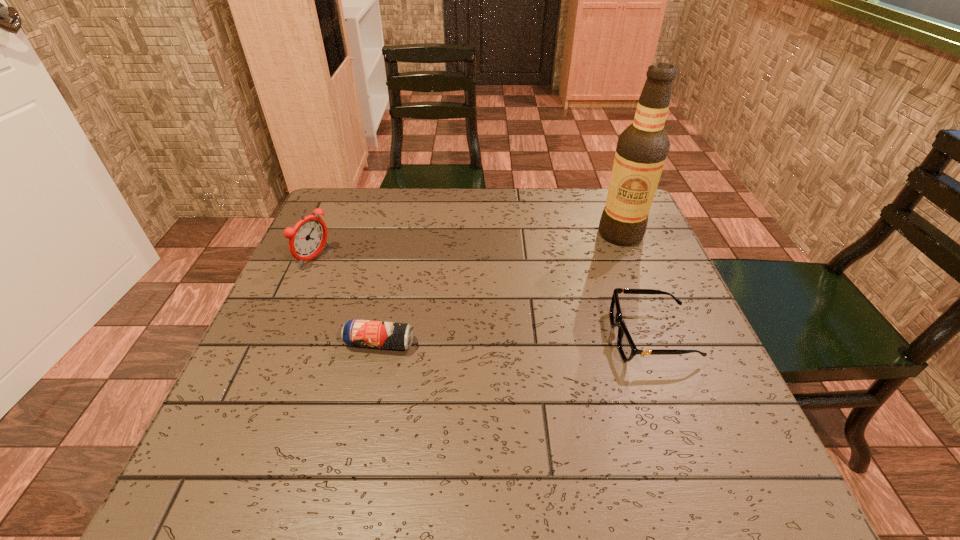
The width and height of the screenshot is (960, 540). I want to click on free space located on the label of the tallest object, so (x=555, y=293).

Identify the location of vacant space located on the label of the tallest object. This screenshot has height=540, width=960. (553, 295).

This screenshot has height=540, width=960. Find the location of `free region located on the front-facing side of the leftmost object`. free region located on the front-facing side of the leftmost object is located at coordinates (367, 281).

This screenshot has height=540, width=960. Find the location of `free spot located on the front-facing side of the leftmost object`. free spot located on the front-facing side of the leftmost object is located at coordinates (450, 317).

The image size is (960, 540). What are the coordinates of `vacant space located on the front-facing side of the leftmost object` in the screenshot? It's located at (446, 315).

Find the location of a particular element. object that is at the far edge is located at coordinates (642, 148).

Where is `object at the left edge`? This screenshot has width=960, height=540. object at the left edge is located at coordinates (308, 237).

Find the location of `sunglasses present at the right edge`. sunglasses present at the right edge is located at coordinates (627, 349).

You are a GUI agent. You are given a task and a screenshot of the screen. Output one action in this format:
    pyautogui.click(x=<x>, y=<y>)
    Task: Click on the alcohol present at the right edge
    The width and height of the screenshot is (960, 540).
    Given the screenshot: What is the action you would take?
    pyautogui.click(x=642, y=148)

Where is `object present at the far right corner`? This screenshot has width=960, height=540. object present at the far right corner is located at coordinates (642, 148).